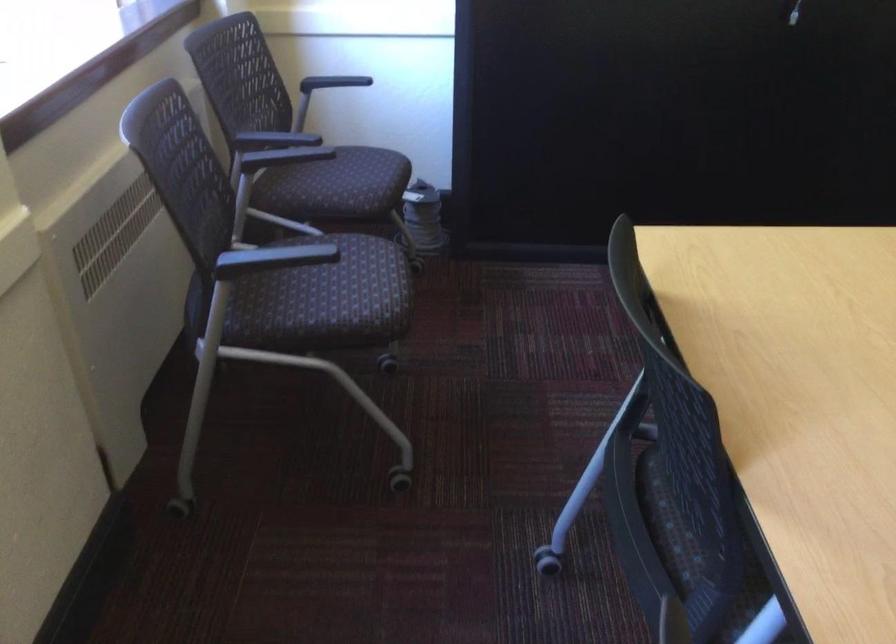
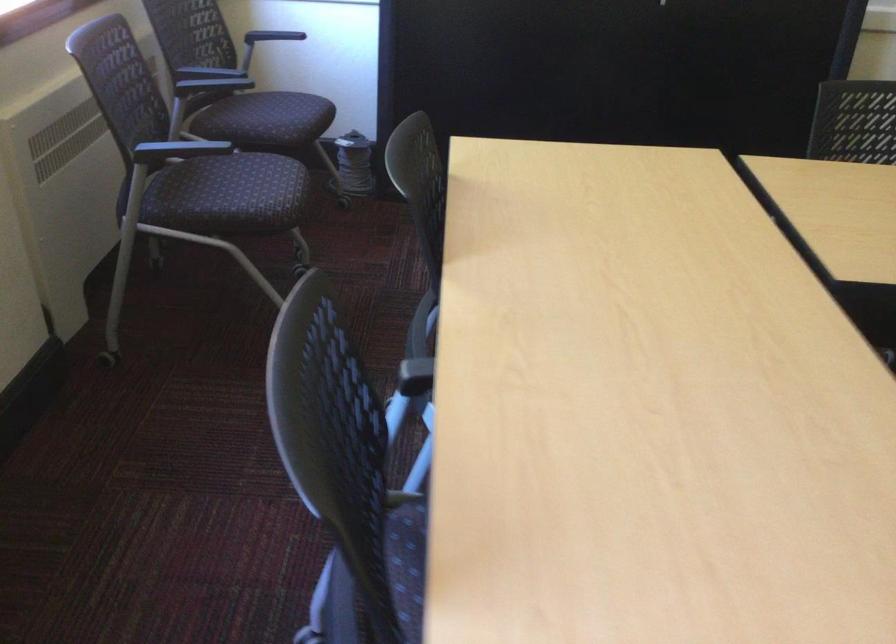
Locate, in the second image, the point that corresponds to [346,190] in the first image.

(271, 120)